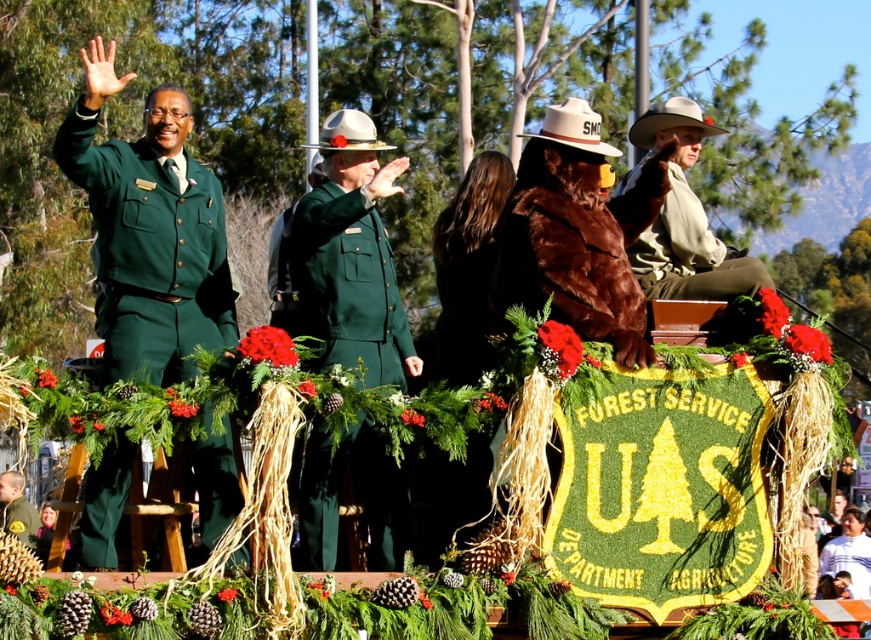
Question: Which object is farther from the camera taking this photo?

Choices:
 (A) green matte uniform at center
 (B) green uniform at center

Answer: (B)

Question: Can you confirm if brown furry bear at center is thinner than green uniform at center?

Choices:
 (A) no
 (B) yes

Answer: (B)

Question: Which object is the closest to the green matte uniform at center?

Choices:
 (A) green uniform at center
 (B) brown furry bear at center
 (C) green matte uniform at left
 (D) brown fur coat at upper right

Answer: (C)

Question: Where is brown furry bear at center located in relation to brown fur coat at upper right in the image?

Choices:
 (A) below
 (B) above

Answer: (A)

Question: Which point is closer to the camera?

Choices:
 (A) (230, 449)
 (B) (647, 232)

Answer: (A)

Question: Does green matte uniform at center appear on the right side of brown fur coat at upper right?

Choices:
 (A) yes
 (B) no

Answer: (B)